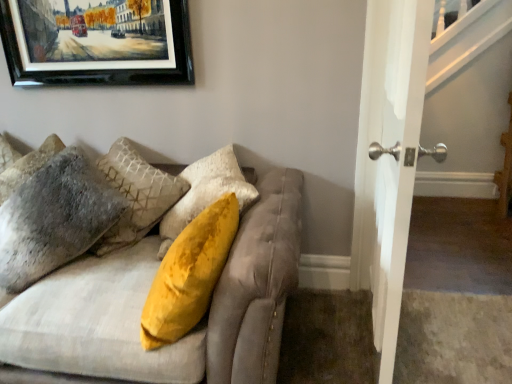
You are a GUI agent. You are given a task and a screenshot of the screen. Output one action in this format:
    pyautogui.click(x=<x>, y=<y>)
    Task: Click on the fuzzy gray pillow at left, the 1th pillow viewed from the right
    This screenshot has width=512, height=384.
    Given the screenshot: What is the action you would take?
    pyautogui.click(x=54, y=218)

The width and height of the screenshot is (512, 384). Identify the location of velvet beige couch at upper left. (145, 298).

Where is `fuzzy gray pillow at left, marked as the 2th pillow in a left-to-right arrangement`? This screenshot has width=512, height=384. fuzzy gray pillow at left, marked as the 2th pillow in a left-to-right arrangement is located at coordinates (54, 218).

Who is bigger, fuzzy gray pillow at left, the 1th pillow viewed from the right, or velvet beige couch at upper left?

Bigger between the two is velvet beige couch at upper left.

Does fuzzy gray pillow at left, the 1th pillow viewed from the right, have a lesser height compared to velvet beige couch at upper left?

No.

Measure the distance from fuzzy gray pillow at left, the 1th pillow viewed from the right, to velvet beige couch at upper left.

fuzzy gray pillow at left, the 1th pillow viewed from the right, is 12.86 inches from velvet beige couch at upper left.

From a real-world perspective, which is physically below, fuzzy gray pillow at left, the 1th pillow viewed from the right, or velvet beige couch at upper left?

In real-world perspective, velvet beige couch at upper left is lower.

Is the surface of velvet beige couch at upper left in direct contact with black matte picture frame at upper left?

No.

From a real-world perspective, between velvet beige couch at upper left and black matte picture frame at upper left, who is vertically lower?

velvet beige couch at upper left, from a real-world perspective.

From the picture: Can you confirm if velvet beige couch at upper left is bigger than black matte picture frame at upper left?

Yes, velvet beige couch at upper left is bigger than black matte picture frame at upper left.

Which is in front, point (58, 313) or point (129, 47)?

The point (58, 313) is closer to the camera.

Between point (238, 259) and point (17, 181), which one is positioned behind?

The point (17, 181) is farther.

Can you confirm if velvet beige couch at upper left is shorter than fuzzy gray pillow at left, placed as the 1th pillow when sorted from left to right?

In fact, velvet beige couch at upper left may be taller than fuzzy gray pillow at left, placed as the 1th pillow when sorted from left to right.

Is velvet beige couch at upper left in front of or behind fuzzy gray pillow at left, the 2th pillow positioned from the right, in the image?

Clearly, velvet beige couch at upper left is in front of fuzzy gray pillow at left, the 2th pillow positioned from the right.

Image resolution: width=512 pixels, height=384 pixels. In order to click on studio couch beneath the fuzzy gray pillow at left, the 2th pillow positioned from the right (from a real-world perspective) in this screenshot , I will do `click(145, 298)`.

From the image's perspective, between fuzzy gray pillow at left, the 2th pillow positioned from the right, and fuzzy gray pillow at left, the 1th pillow viewed from the right, who is located below?

fuzzy gray pillow at left, the 1th pillow viewed from the right, is shown below in the image.

Considering the relative positions of fuzzy gray pillow at left, placed as the 1th pillow when sorted from left to right, and fuzzy gray pillow at left, the 1th pillow viewed from the right, in the image provided, is fuzzy gray pillow at left, placed as the 1th pillow when sorted from left to right, to the left or to the right of fuzzy gray pillow at left, the 1th pillow viewed from the right,?

fuzzy gray pillow at left, placed as the 1th pillow when sorted from left to right, is to the left of fuzzy gray pillow at left, the 1th pillow viewed from the right.

Considering the relative sizes of fuzzy gray pillow at left, placed as the 1th pillow when sorted from left to right, and fuzzy gray pillow at left, the 1th pillow viewed from the right, in the image provided, is fuzzy gray pillow at left, placed as the 1th pillow when sorted from left to right, bigger than fuzzy gray pillow at left, the 1th pillow viewed from the right,?

No.

Is fuzzy gray pillow at left, the 2th pillow positioned from the right, inside the boundaries of fuzzy gray pillow at left, the 1th pillow viewed from the right, or outside?

fuzzy gray pillow at left, the 2th pillow positioned from the right, is located beyond the bounds of fuzzy gray pillow at left, the 1th pillow viewed from the right.

How different are the orientations of black matte picture frame at upper left and fuzzy gray pillow at left, the 2th pillow positioned from the right, in degrees?

32.8 degrees separate the facing orientations of black matte picture frame at upper left and fuzzy gray pillow at left, the 2th pillow positioned from the right.

Is point (17, 3) less distant than point (15, 169)?

Yes, point (17, 3) is in front of point (15, 169).

Are black matte picture frame at upper left and fuzzy gray pillow at left, the 2th pillow positioned from the right, located far from each other?

black matte picture frame at upper left is actually quite close to fuzzy gray pillow at left, the 2th pillow positioned from the right.

Looking at this image, is fuzzy gray pillow at left, the 1th pillow viewed from the right, not inside black matte picture frame at upper left?

Yes.

The height and width of the screenshot is (384, 512). What are the coordinates of `the 2nd pillow in front of the black matte picture frame at upper left` in the screenshot? It's located at (54, 218).

Does point (52, 243) appear closer or farther from the camera than point (173, 59)?

Point (52, 243) appears to be closer to the viewer than point (173, 59).

Is fuzzy gray pillow at left, marked as the 2th pillow in a left-to-right arrangement, a part of velvet beige couch at upper left?

Yes, velvet beige couch at upper left is surrounding fuzzy gray pillow at left, marked as the 2th pillow in a left-to-right arrangement.

Considering the sizes of objects velvet beige couch at upper left and fuzzy gray pillow at left, the 1th pillow viewed from the right, in the image provided, who is thinner, velvet beige couch at upper left or fuzzy gray pillow at left, the 1th pillow viewed from the right,?

Thinner between the two is fuzzy gray pillow at left, the 1th pillow viewed from the right.

Considering the sizes of objects velvet beige couch at upper left and fuzzy gray pillow at left, marked as the 2th pillow in a left-to-right arrangement, in the image provided, who is shorter, velvet beige couch at upper left or fuzzy gray pillow at left, marked as the 2th pillow in a left-to-right arrangement,?

With less height is velvet beige couch at upper left.

From the image's perspective, would you say velvet beige couch at upper left is shown under fuzzy gray pillow at left, marked as the 2th pillow in a left-to-right arrangement?

Result: Yes.

Starting from the velvet beige couch at upper left, which pillow is the 1st one to the left? Please provide its 2D coordinates.

[(54, 218)]

You are a GUI agent. You are given a task and a screenshot of the screen. Output one action in this format:
    pyautogui.click(x=<x>, y=<y>)
    Task: Click on the picture frame that appears above the velvet beige couch at upper left (from a real-world perspective)
    The height and width of the screenshot is (384, 512).
    Given the screenshot: What is the action you would take?
    pyautogui.click(x=97, y=42)

From the image, which object appears to be farther from fuzzy gray pillow at left, the 2th pillow positioned from the right, black matte picture frame at upper left or fuzzy gray pillow at left, the 1th pillow viewed from the right?

black matte picture frame at upper left is further to fuzzy gray pillow at left, the 2th pillow positioned from the right.

Which object lies further to the anchor point fuzzy gray pillow at left, the 2th pillow positioned from the right, fuzzy gray pillow at left, the 1th pillow viewed from the right, or black matte picture frame at upper left?

Among the two, black matte picture frame at upper left is located further to fuzzy gray pillow at left, the 2th pillow positioned from the right.

Looking at the image, which one is located closer to velvet beige couch at upper left, fuzzy gray pillow at left, marked as the 2th pillow in a left-to-right arrangement, or black matte picture frame at upper left?

Based on the image, fuzzy gray pillow at left, marked as the 2th pillow in a left-to-right arrangement, appears to be nearer to velvet beige couch at upper left.

Which object lies nearer to the anchor point velvet beige couch at upper left, black matte picture frame at upper left or fuzzy gray pillow at left, placed as the 1th pillow when sorted from left to right?

Among the two, fuzzy gray pillow at left, placed as the 1th pillow when sorted from left to right, is located nearer to velvet beige couch at upper left.

Estimate the real-world distances between objects in this image. Which object is further from fuzzy gray pillow at left, marked as the 2th pillow in a left-to-right arrangement, fuzzy gray pillow at left, placed as the 1th pillow when sorted from left to right, or black matte picture frame at upper left?

The object further to fuzzy gray pillow at left, marked as the 2th pillow in a left-to-right arrangement, is black matte picture frame at upper left.

When comparing their distances from fuzzy gray pillow at left, placed as the 1th pillow when sorted from left to right, does velvet beige couch at upper left or black matte picture frame at upper left seem closer?

black matte picture frame at upper left is positioned closer to the anchor fuzzy gray pillow at left, placed as the 1th pillow when sorted from left to right.

From the picture: Estimate the real-world distances between objects in this image. Which object is closer to fuzzy gray pillow at left, the 2th pillow positioned from the right, velvet beige couch at upper left or fuzzy gray pillow at left, the 1th pillow viewed from the right?

Among the two, fuzzy gray pillow at left, the 1th pillow viewed from the right, is located nearer to fuzzy gray pillow at left, the 2th pillow positioned from the right.

When comparing their distances from fuzzy gray pillow at left, marked as the 2th pillow in a left-to-right arrangement, does black matte picture frame at upper left or fuzzy gray pillow at left, placed as the 1th pillow when sorted from left to right, seem closer?

fuzzy gray pillow at left, placed as the 1th pillow when sorted from left to right.

The width and height of the screenshot is (512, 384). In order to click on pillow between black matte picture frame at upper left and fuzzy gray pillow at left, marked as the 2th pillow in a left-to-right arrangement, in the up-down direction in this screenshot , I will do `click(28, 166)`.

The width and height of the screenshot is (512, 384). I want to click on pillow between velvet beige couch at upper left and fuzzy gray pillow at left, placed as the 1th pillow when sorted from left to right, in the front-back direction, so click(54, 218).